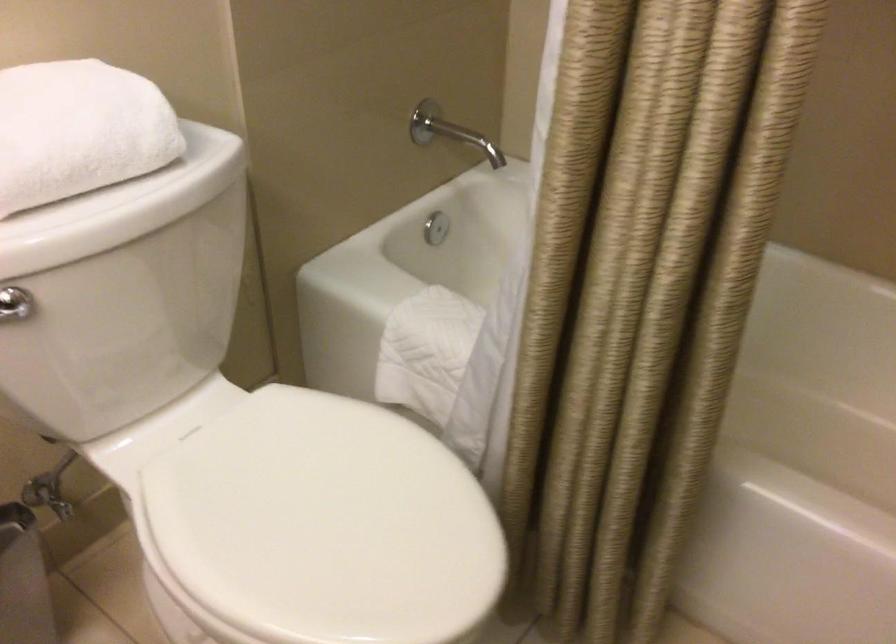
Question: The images are taken continuously from a first-person perspective. In which direction is your viewpoint rotating?

Choices:
 (A) Left
 (B) Right
 (C) Up
 (D) Down

Answer: (D)